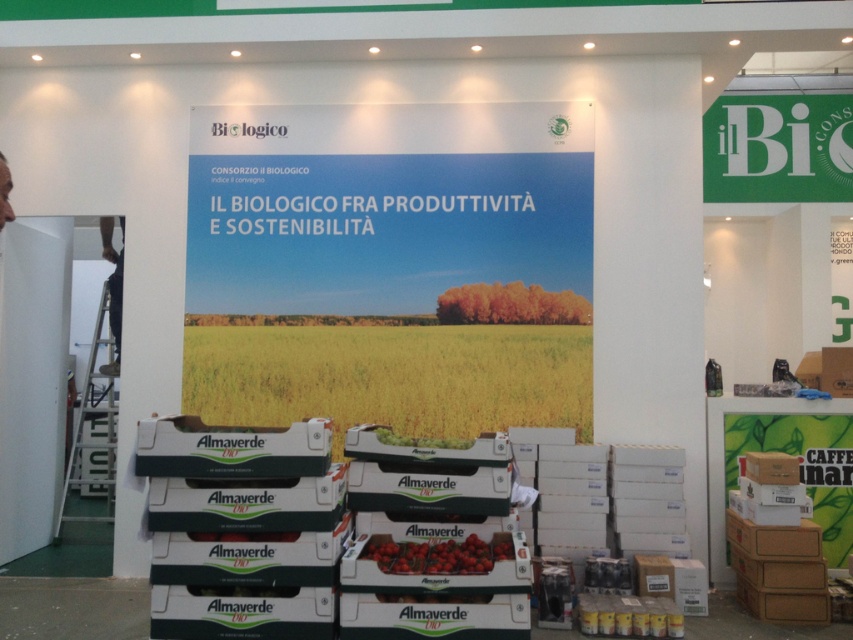
You are a photographer standing at the entrance of the booth and want to take a clear photo of the red matte tomatoes at center. Your camera has a minimum focusing distance of 4 meters. Can you take a clear photo without moving closer?

The red matte tomatoes at center and camera are 3.92 meters apart, which is less than the camera minimum focusing distance of 4 meters. Therefore, the photographer cannot take a clear photo without moving closer.

You are organizing a photo shoot for the booth and need to ensure that the red matte tomatoes at center and the matte green tomato at center are properly framed. Which object should you focus on to capture the larger size in the frame?

The matte green tomato at center should be focused on to capture the larger size in the frame since it occupies more space than the red matte tomatoes at center.